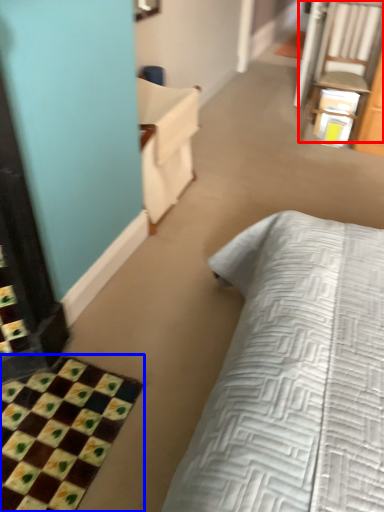
Question: Which of the following is the closest to the observer, chair (highlighted by a red box) or bath mat (highlighted by a blue box)?

Choices:
 (A) chair
 (B) bath mat

Answer: (B)